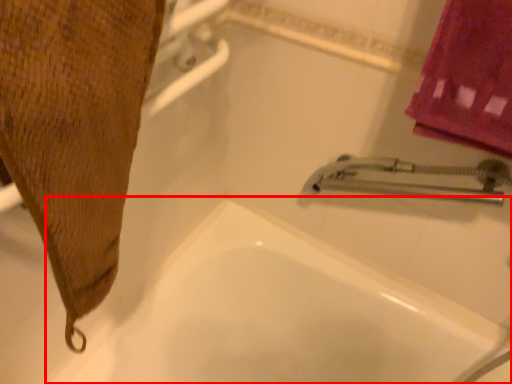
Question: From the image's perspective, what is the correct spatial positioning of bath (annotated by the red box) in reference to bath towel?

Choices:
 (A) below
 (B) above

Answer: (A)